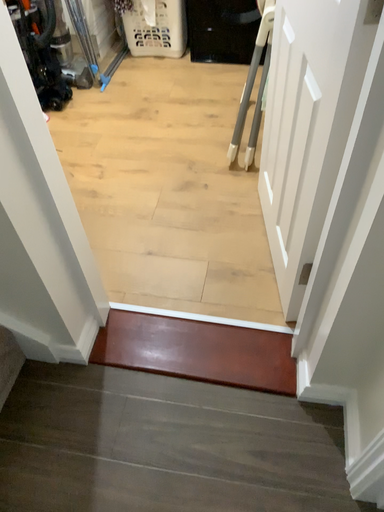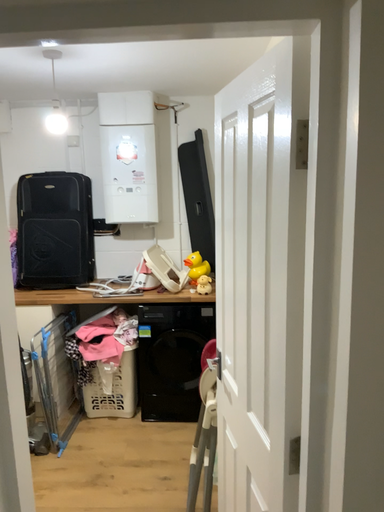
Question: How did the camera likely rotate when shooting the video?

Choices:
 (A) rotated downward
 (B) rotated upward

Answer: (B)